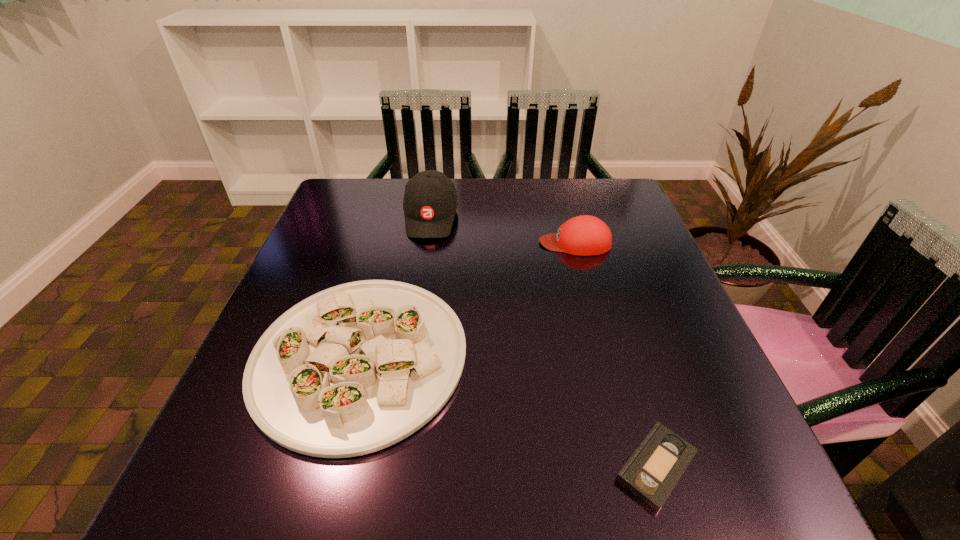
This screenshot has width=960, height=540. In the image, there is a desktop. Identify the location of vacant space at the left edge. (375, 234).

In the image, there is a desktop. Where is `vacant space at the right edge`? The width and height of the screenshot is (960, 540). vacant space at the right edge is located at coordinates (691, 388).

This screenshot has width=960, height=540. I want to click on free space at the far left corner of the desktop, so pyautogui.click(x=380, y=218).

In the image, there is a desktop. Identify the location of vacant space at the far right corner. The width and height of the screenshot is (960, 540). (609, 198).

This screenshot has height=540, width=960. I want to click on free space between the platter and the videotape, so click(x=508, y=412).

Where is `unoccupied area between the platter and the videotape`? The image size is (960, 540). unoccupied area between the platter and the videotape is located at coordinates (508, 412).

Where is `unoccupied position between the videotape and the platter`? The height and width of the screenshot is (540, 960). unoccupied position between the videotape and the platter is located at coordinates (508, 412).

The image size is (960, 540). I want to click on free space between the left baseball cap and the shorter baseball cap, so click(x=503, y=230).

Identify the location of free space between the videotape and the platter. (508, 412).

Locate an element on the screen. The image size is (960, 540). vacant point located between the platter and the shorter baseball cap is located at coordinates (468, 300).